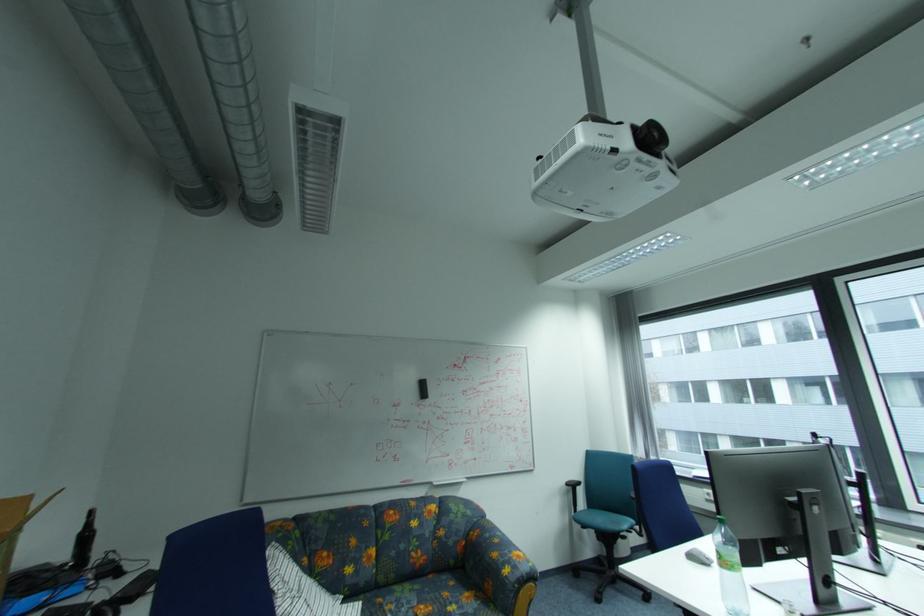
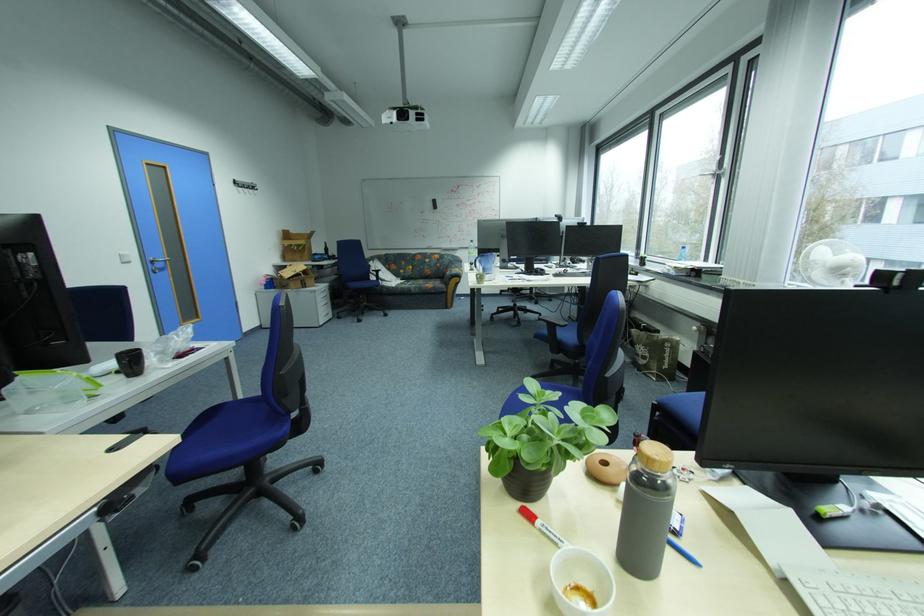
Find the pixel in the second image that matches (478,514) in the first image.

(460, 261)